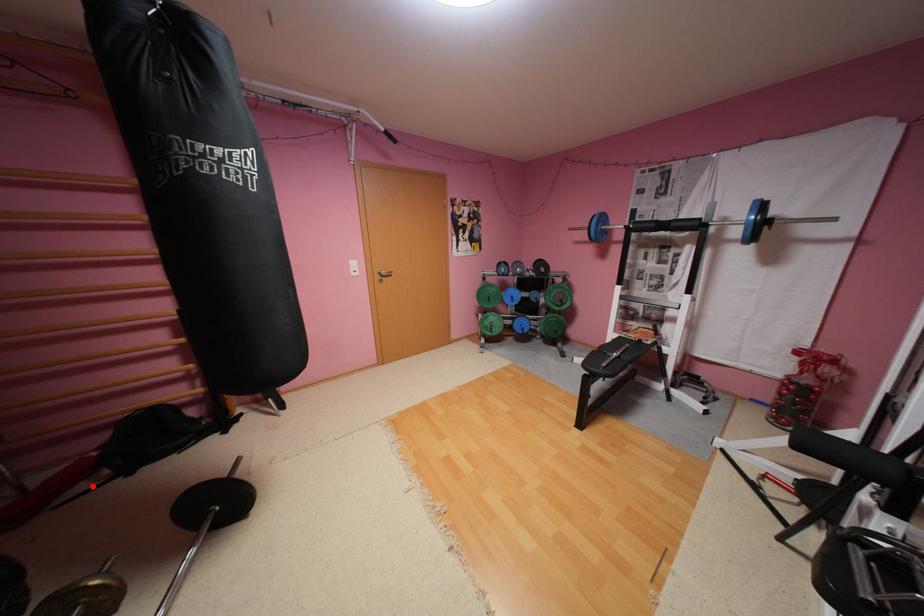
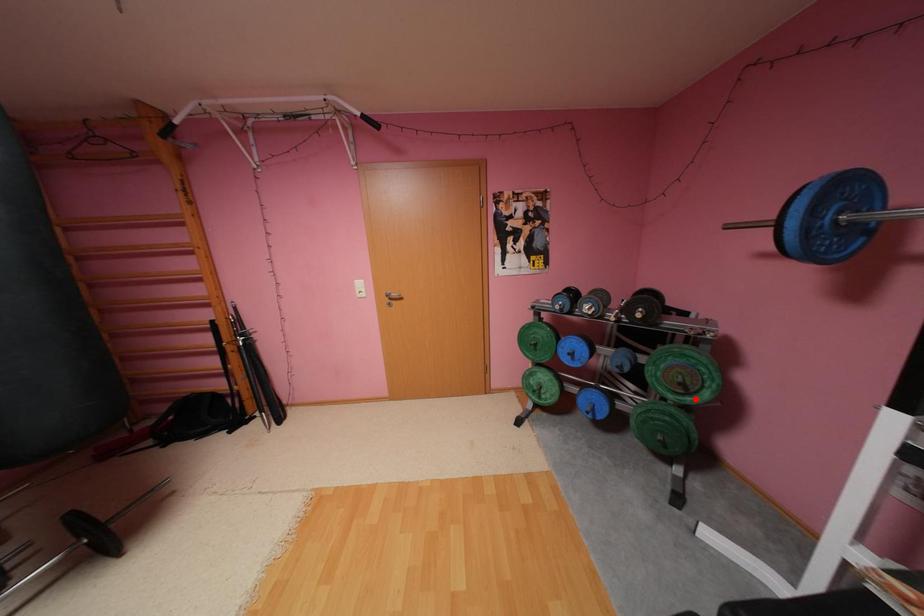
I am providing you with two images of the same scene from different viewpoints. A red point is marked on the first image and another point is marked on the second image. Is the marked point in image1 the same physical position as the marked point in image2?

No